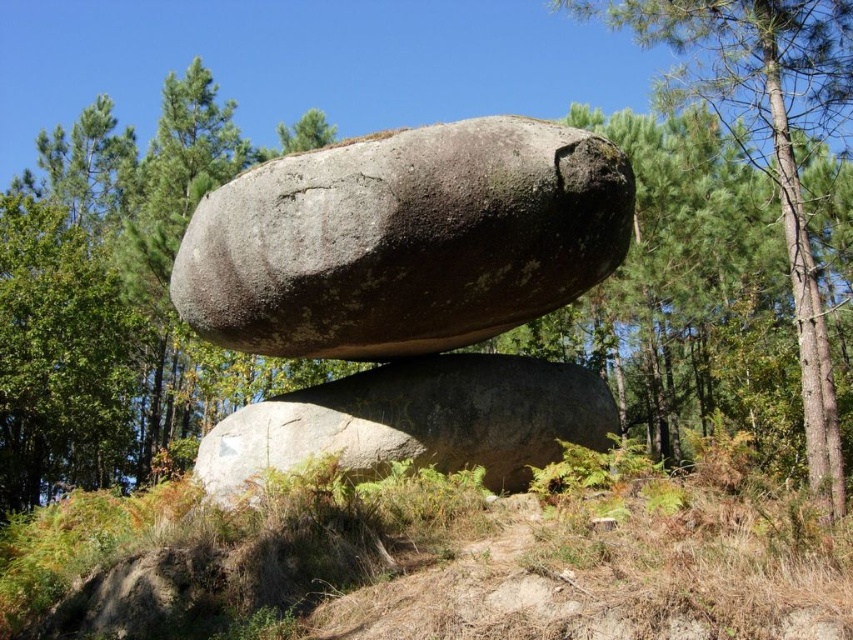
Does gray rough rock at center appear under green leafy tree at upper right?

Actually, gray rough rock at center is above green leafy tree at upper right.

In the scene shown: Is the position of gray rough rock at center less distant than that of green leafy tree at upper right?

Yes, gray rough rock at center is in front of green leafy tree at upper right.

Who is more distant from viewer, (303, 173) or (851, 109)?

Positioned behind is point (851, 109).

At what (x,y) coordinates should I click in order to perform the action: click on gray rough rock at center. Please return your answer as a coordinate pair (x, y). This screenshot has width=853, height=640. Looking at the image, I should click on (404, 241).

Between gray rough rock at center and gray rough boulder at center, which one has less height?

With less height is gray rough boulder at center.

Is gray rough rock at center further to camera compared to gray rough boulder at center?

No, it is not.

Where is `gray rough rock at center`? The width and height of the screenshot is (853, 640). gray rough rock at center is located at coordinates (404, 241).

Find the location of a particular element. The height and width of the screenshot is (640, 853). gray rough rock at center is located at coordinates (404, 241).

Locate an element on the screen. The width and height of the screenshot is (853, 640). gray rough boulder at center is located at coordinates (416, 420).

Is gray rough boulder at center further to camera compared to green leafy tree at upper right?

No.

Is point (520, 472) closer to camera compared to point (813, 52)?

Yes, point (520, 472) is in front of point (813, 52).

Find the location of a particular element. gray rough boulder at center is located at coordinates (416, 420).